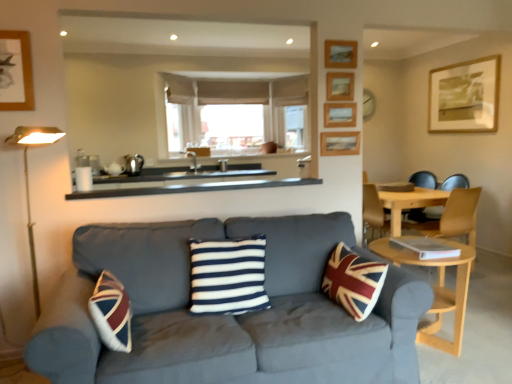
Question: Is white matte window frame at center at the right side of wooden framed picture at upper right, which appears as the first picture frame when viewed from the right?

Choices:
 (A) no
 (B) yes

Answer: (A)

Question: Does white matte window frame at center have a lesser height compared to wooden framed picture at upper right, which ranks as the 5th picture frame in front-to-back order?

Choices:
 (A) yes
 (B) no

Answer: (B)

Question: Is white matte window frame at center bigger than wooden framed picture at upper right, positioned as the 5th picture frame in left-to-right order?

Choices:
 (A) yes
 (B) no

Answer: (A)

Question: Considering the relative sizes of white matte window frame at center and wooden framed picture at upper right, which ranks as the 5th picture frame in front-to-back order, in the image provided, is white matte window frame at center wider than wooden framed picture at upper right, which ranks as the 5th picture frame in front-to-back order,?

Choices:
 (A) no
 (B) yes

Answer: (B)

Question: From a real-world perspective, is white matte window frame at center physically below wooden framed picture at upper right, which ranks as the 5th picture frame in front-to-back order?

Choices:
 (A) yes
 (B) no

Answer: (A)

Question: Does white matte window frame at center touch wooden framed picture at upper right, which appears as the first picture frame when viewed from the right?

Choices:
 (A) no
 (B) yes

Answer: (A)

Question: From the image's perspective, is white matte window frame at center beneath wooden picture frame at upper center, which is the 3th picture frame from right to left?

Choices:
 (A) no
 (B) yes

Answer: (A)

Question: Is white matte window frame at center thinner than wooden picture frame at upper center, which ranks as the third picture frame in left-to-right order?

Choices:
 (A) no
 (B) yes

Answer: (A)

Question: Can you confirm if white matte window frame at center is bigger than wooden picture frame at upper center, which is counted as the 3th picture frame, starting from the back?

Choices:
 (A) yes
 (B) no

Answer: (A)

Question: From a real-world perspective, is white matte window frame at center below wooden picture frame at upper center, which is counted as the 3th picture frame, starting from the back?

Choices:
 (A) yes
 (B) no

Answer: (B)

Question: Is white matte window frame at center far away from wooden picture frame at upper center, which is counted as the 3th picture frame, starting from the back?

Choices:
 (A) yes
 (B) no

Answer: (A)

Question: Is wooden picture frame at upper center, which ranks as the third picture frame in left-to-right order, inside white matte window frame at center?

Choices:
 (A) no
 (B) yes

Answer: (A)

Question: Is wooden picture frame at upper center, which is counted as the third picture frame, starting from the front, at the back of light wood round table at lower right?

Choices:
 (A) no
 (B) yes

Answer: (A)